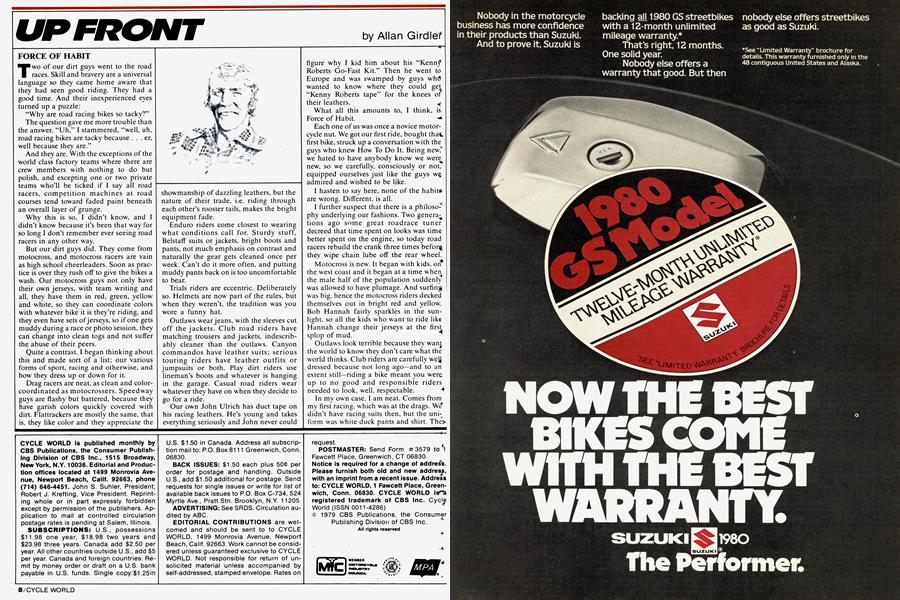
Find the location of a particular element. The image size is (900, 600). sticker is located at coordinates (610, 453).